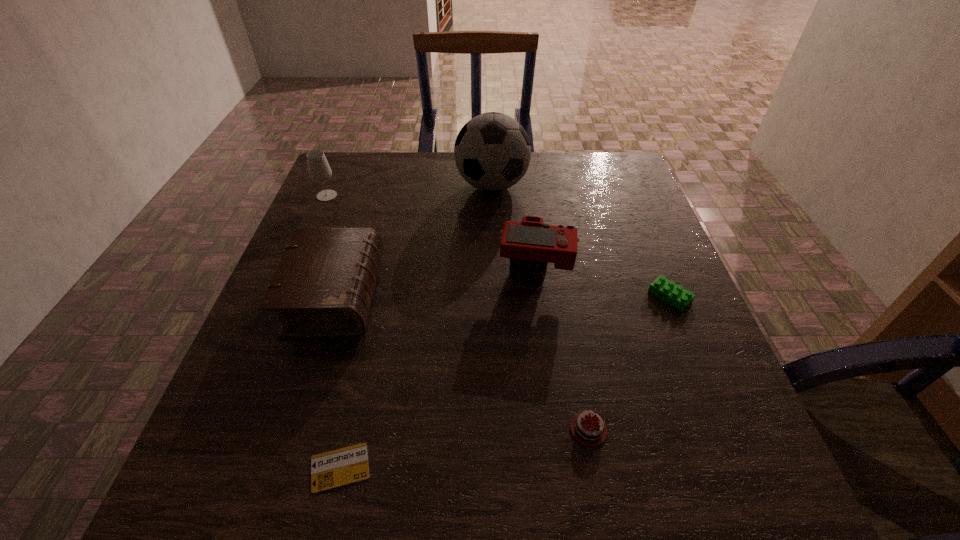
Find the location of a particular element. The width and height of the screenshot is (960, 540). object that is at the right edge is located at coordinates (675, 295).

This screenshot has width=960, height=540. In order to click on object present at the far left corner in this screenshot , I will do `click(319, 170)`.

I want to click on vacant space at the far edge of the desktop, so click(414, 168).

Find the location of a particular element. free location at the near edge is located at coordinates (468, 517).

Find the location of `vacant space at the right edge`. vacant space at the right edge is located at coordinates (618, 245).

The image size is (960, 540). Find the location of `vacant region at the far right corner of the desktop`. vacant region at the far right corner of the desktop is located at coordinates (600, 170).

Locate an element on the screen. The height and width of the screenshot is (540, 960). vacant space at the near right corner of the desktop is located at coordinates (734, 510).

The width and height of the screenshot is (960, 540). I want to click on free point between the camera and the glass, so click(431, 234).

Locate an element on the screen. The width and height of the screenshot is (960, 540). free space between the chocolate cake and the Bible is located at coordinates (462, 363).

Where is `free space between the fourth tallest object and the chocolate cake`? Image resolution: width=960 pixels, height=540 pixels. free space between the fourth tallest object and the chocolate cake is located at coordinates (462, 363).